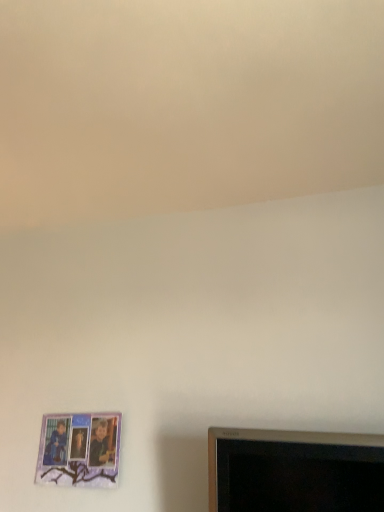
Question: Should I look upward or downward to see purple paper picture frame at lower left?

Choices:
 (A) up
 (B) down

Answer: (B)